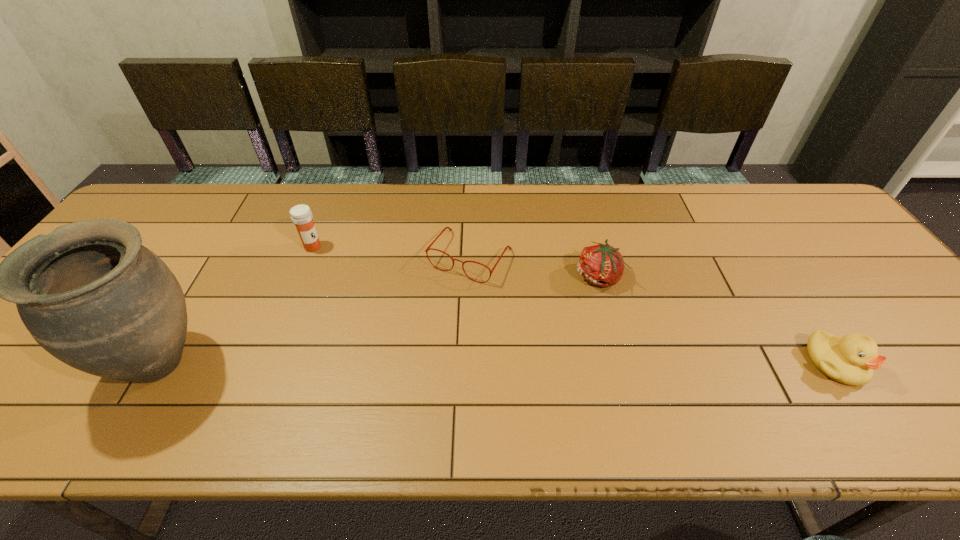
Locate an element on the screen. This screenshot has width=960, height=540. free space on the desktop that is between the urn and the rightmost object and is positioned on the label side of the second object from left to right is located at coordinates (485, 363).

At what (x,y) coordinates should I click in order to perform the action: click on free spot on the desktop that is between the urn and the duckling and is positioned on the front-facing side of the second object from right to left. Please return your answer as a coordinate pair (x, y). This screenshot has width=960, height=540. Looking at the image, I should click on (459, 363).

This screenshot has width=960, height=540. Identify the location of free spot on the desktop that is between the tallest object and the rightmost object and is positioned on the face of the shortest object. (399, 363).